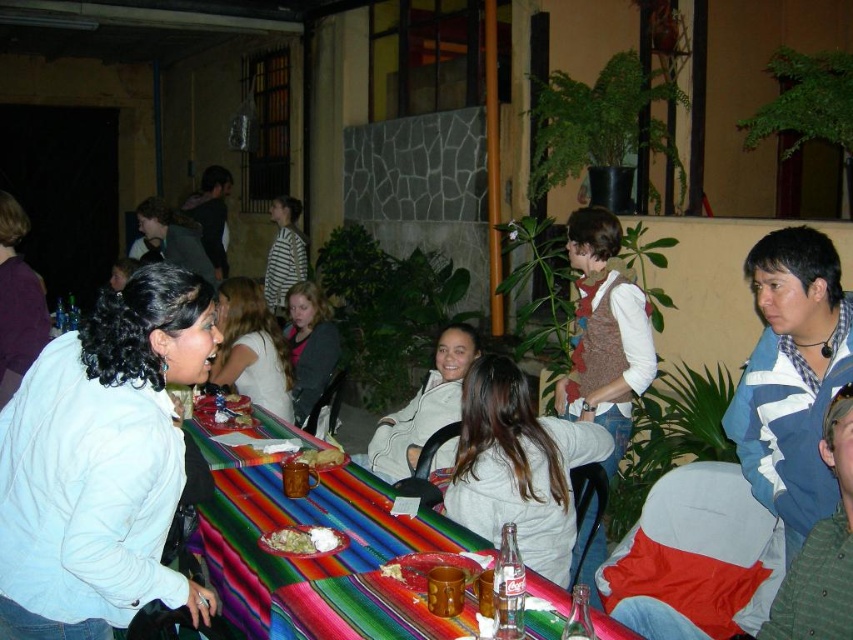
The image size is (853, 640). What do you see at coordinates (302, 540) in the screenshot? I see `white rice at table center` at bounding box center [302, 540].

Does white rice at table center have a larger size compared to smooth brown bread at center?

No, white rice at table center is not bigger than smooth brown bread at center.

This screenshot has height=640, width=853. What do you see at coordinates (302, 540) in the screenshot?
I see `white rice at table center` at bounding box center [302, 540].

Where is `white rice at table center`? The width and height of the screenshot is (853, 640). white rice at table center is located at coordinates (302, 540).

Is white matte jacket at upper left positioned at the back of multicolored woven tablecloth at center?

No, white matte jacket at upper left is in front of multicolored woven tablecloth at center.

Does point (177, 577) come in front of point (560, 612)?

Yes, it is.

I want to click on white matte jacket at upper left, so click(x=102, y=464).

Describe the element at coordinates (312, 557) in the screenshot. The height and width of the screenshot is (640, 853). I see `multicolored woven tablecloth at center` at that location.

Does multicolored woven tablecloth at center have a smaller size compared to smooth brown bread at center?

No, multicolored woven tablecloth at center is not smaller than smooth brown bread at center.

Between point (345, 470) and point (329, 452), which one is positioned in front?

Positioned in front is point (345, 470).

In order to click on multicolored woven tablecloth at center in this screenshot , I will do click(x=312, y=557).